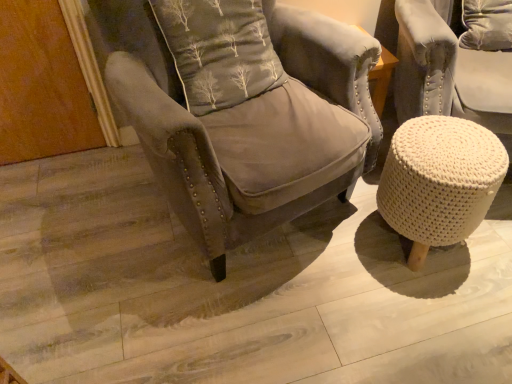
Question: Considering the relative sizes of velvet gray armchair at center and white knitted stool at lower right in the image provided, is velvet gray armchair at center wider than white knitted stool at lower right?

Choices:
 (A) yes
 (B) no

Answer: (A)

Question: Is velvet gray armchair at center shorter than white knitted stool at lower right?

Choices:
 (A) yes
 (B) no

Answer: (B)

Question: Is velvet gray armchair at center aimed at white knitted stool at lower right?

Choices:
 (A) no
 (B) yes

Answer: (B)

Question: From a real-world perspective, is velvet gray armchair at center positioned over white knitted stool at lower right based on gravity?

Choices:
 (A) yes
 (B) no

Answer: (A)

Question: Considering the relative sizes of velvet gray armchair at center and white knitted stool at lower right in the image provided, is velvet gray armchair at center smaller than white knitted stool at lower right?

Choices:
 (A) yes
 (B) no

Answer: (B)

Question: Considering the positions of velvet gray armchair at center and gray fabric pillow at center in the image, is velvet gray armchair at center bigger or smaller than gray fabric pillow at center?

Choices:
 (A) big
 (B) small

Answer: (A)

Question: Is velvet gray armchair at center in front of or behind gray fabric pillow at center in the image?

Choices:
 (A) front
 (B) behind

Answer: (A)

Question: In terms of height, does velvet gray armchair at center look taller or shorter compared to gray fabric pillow at center?

Choices:
 (A) tall
 (B) short

Answer: (A)

Question: Which is correct: velvet gray armchair at center is inside gray fabric pillow at center, or outside of it?

Choices:
 (A) outside
 (B) inside

Answer: (A)

Question: Does point (443, 210) appear closer or farther from the camera than point (221, 91)?

Choices:
 (A) farther
 (B) closer

Answer: (B)

Question: Which is correct: white knitted stool at lower right is inside gray fabric pillow at center, or outside of it?

Choices:
 (A) inside
 (B) outside

Answer: (B)

Question: Considering the positions of white knitted stool at lower right and gray fabric pillow at center in the image, is white knitted stool at lower right wider or thinner than gray fabric pillow at center?

Choices:
 (A) thin
 (B) wide

Answer: (B)

Question: From a real-world perspective, is white knitted stool at lower right physically located above or below gray fabric pillow at center?

Choices:
 (A) above
 (B) below

Answer: (B)

Question: Would you say gray fabric pillow at center is to the left or to the right of white knitted stool at lower right in the picture?

Choices:
 (A) right
 (B) left

Answer: (B)

Question: In terms of size, does gray fabric pillow at center appear bigger or smaller than white knitted stool at lower right?

Choices:
 (A) small
 (B) big

Answer: (B)